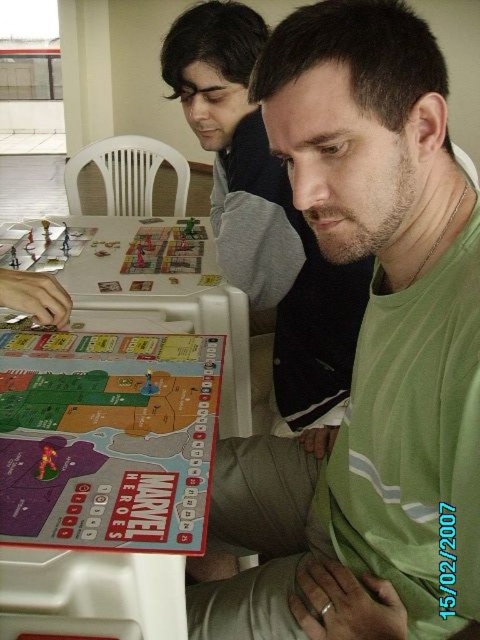
Question: Which object appears closest to the camera in this image?

Choices:
 (A) matte plastic board game at left
 (B) green matte shirt at center
 (C) matte plastic board game at center

Answer: (B)

Question: Which point is farther to the camera?

Choices:
 (A) green matte shirt at center
 (B) matte plastic board game at left
 (C) matte plastic board game at center

Answer: (B)

Question: Which is farther from the green matte shirt at center?

Choices:
 (A) matte plastic board game at center
 (B) matte plastic board game at left

Answer: (B)

Question: Can you confirm if green matte shirt at center is positioned below matte plastic board game at center?

Choices:
 (A) yes
 (B) no

Answer: (B)

Question: Can you confirm if green matte shirt at center is wider than matte plastic board game at left?

Choices:
 (A) no
 (B) yes

Answer: (A)

Question: Is matte plastic board game at center thinner than matte plastic board game at left?

Choices:
 (A) no
 (B) yes

Answer: (B)